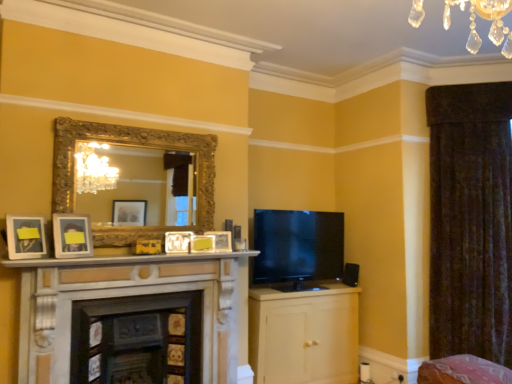
Question: Is point (470, 256) closer or farther from the camera than point (499, 377)?

Choices:
 (A) closer
 (B) farther

Answer: (B)

Question: In terms of height, does velvet dark brown curtain at right look taller or shorter compared to pink fabric swivel chair at lower right?

Choices:
 (A) tall
 (B) short

Answer: (A)

Question: Which is farther from the pink fabric swivel chair at lower right?

Choices:
 (A) matte yellow picture frame at center, the second picture frame in the right-to-left sequence
 (B) matte silver picture frame at left, which is the 5th picture frame from right to left
 (C) matte white picture frame at center, the 4th picture frame in the left-to-right sequence
 (D) matte cream cabinet at center-right
 (E) matte white picture frame at lower left, the first picture frame when ordered from left to right

Answer: (E)

Question: Based on their relative distances, which object is farther from the matte white picture frame at center, the 6th picture frame viewed from the left?

Choices:
 (A) gold ornate mirror at upper center
 (B) matte silver picture frame at left, which is the 5th picture frame from right to left
 (C) matte cream cabinet at center-right
 (D) marble fireplace at center, which appears as the first fireplace when viewed from the right
 (E) velvet dark brown curtain at right

Answer: (E)